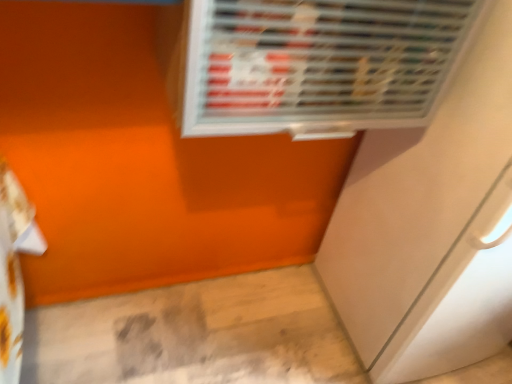
Question: Does white glossy screen door at lower right have a smaller size compared to metallic silver air conditioning at upper center?

Choices:
 (A) yes
 (B) no

Answer: (B)

Question: Is white glossy screen door at lower right taller than metallic silver air conditioning at upper center?

Choices:
 (A) yes
 (B) no

Answer: (A)

Question: From the image's perspective, is white glossy screen door at lower right above metallic silver air conditioning at upper center?

Choices:
 (A) yes
 (B) no

Answer: (B)

Question: Is white glossy screen door at lower right oriented away from metallic silver air conditioning at upper center?

Choices:
 (A) yes
 (B) no

Answer: (B)

Question: Does white glossy screen door at lower right lie in front of metallic silver air conditioning at upper center?

Choices:
 (A) no
 (B) yes

Answer: (A)

Question: Does white glossy screen door at lower right have a greater width compared to metallic silver air conditioning at upper center?

Choices:
 (A) no
 (B) yes

Answer: (B)

Question: From the image's perspective, is metallic silver air conditioning at upper center under white glossy screen door at lower right?

Choices:
 (A) no
 (B) yes

Answer: (A)

Question: Can you confirm if metallic silver air conditioning at upper center is taller than white glossy screen door at lower right?

Choices:
 (A) no
 (B) yes

Answer: (A)

Question: Is metallic silver air conditioning at upper center closer to the viewer compared to white glossy screen door at lower right?

Choices:
 (A) yes
 (B) no

Answer: (A)

Question: From a real-world perspective, is metallic silver air conditioning at upper center physically above white glossy screen door at lower right?

Choices:
 (A) yes
 (B) no

Answer: (A)

Question: Does metallic silver air conditioning at upper center have a larger size compared to white glossy screen door at lower right?

Choices:
 (A) no
 (B) yes

Answer: (A)

Question: Is metallic silver air conditioning at upper center to the left of white glossy screen door at lower right from the viewer's perspective?

Choices:
 (A) no
 (B) yes

Answer: (B)

Question: Do you think metallic silver air conditioning at upper center is within white glossy screen door at lower right, or outside of it?

Choices:
 (A) outside
 (B) inside

Answer: (A)